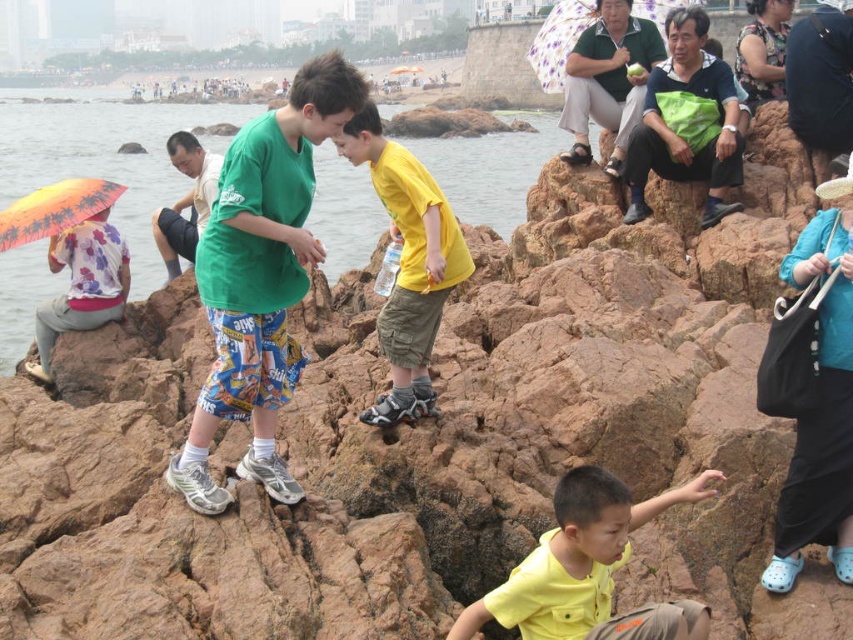
Is yellow matte shirt at center positioned before floral fabric umbrella at left?

That is True.

Between point (651, 506) and point (91, 262), which one is positioned behind?

Point (91, 262)

Locate an element on the screen. Image resolution: width=853 pixels, height=640 pixels. yellow matte shirt at center is located at coordinates (573, 557).

Which of these two, yellow matte shirt at center or floral fabric umbrella at upper center, stands shorter?

With less height is yellow matte shirt at center.

Does yellow matte shirt at center have a lesser height compared to floral fabric umbrella at upper center?

Yes.

Is point (598, 488) farther from viewer compared to point (561, 42)?

No, (598, 488) is in front of (561, 42).

Identify the location of yellow matte shirt at center. pos(573,557).

Does floral fabric umbrella at left have a smaller size compared to floral fabric umbrella at upper center?

Yes.

Does floral fabric umbrella at left appear on the right side of floral fabric umbrella at upper center?

No, floral fabric umbrella at left is not to the right of floral fabric umbrella at upper center.

What are the coordinates of `floral fabric umbrella at left` in the screenshot? It's located at (82, 285).